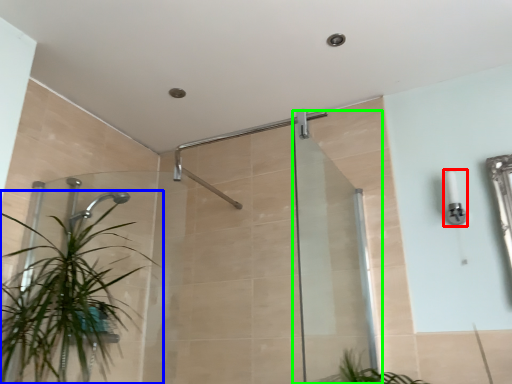
Question: Based on their relative distances, which object is farther from light fixture (highlighted by a red box)? Choose from houseplant (highlighted by a blue box) and screen door (highlighted by a green box).

Choices:
 (A) houseplant
 (B) screen door

Answer: (A)